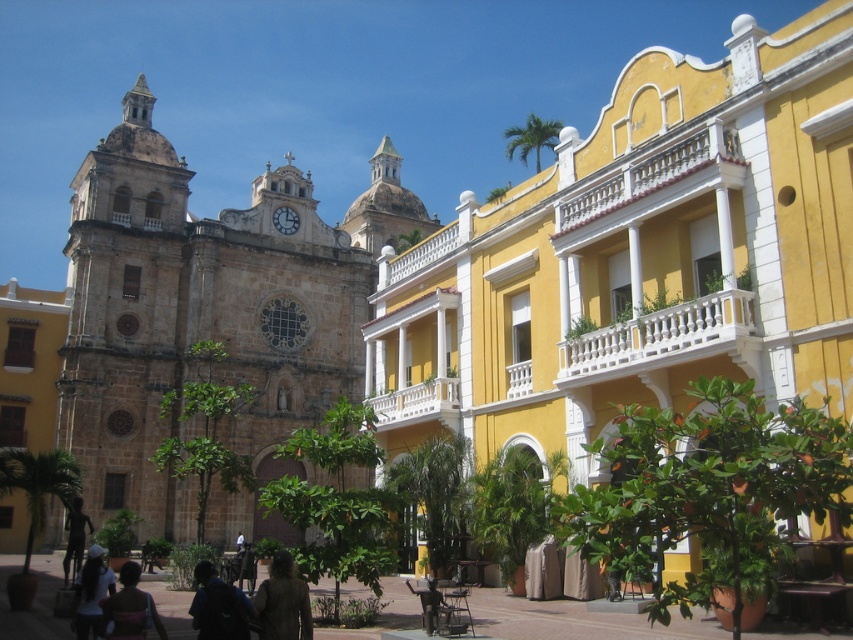
Which is behind, point (770, 212) or point (283, 573)?

The point (770, 212) is behind.

Consider the image. Is the position of matte stone church at center less distant than that of brown textured coat at lower center?

Yes, matte stone church at center is in front of brown textured coat at lower center.

Does point (573, 362) lie in front of point (299, 632)?

No, (573, 362) is behind (299, 632).

The height and width of the screenshot is (640, 853). Identify the location of matte stone church at center. (639, 257).

What do you see at coordinates (207, 317) in the screenshot? The image size is (853, 640). I see `brown stone church at left` at bounding box center [207, 317].

Locate an element on the screen. brown stone church at left is located at coordinates (207, 317).

Identify the location of brown stone church at left. (207, 317).

Can you confirm if dark blue backpack at lower center is bigger than dark brown leather jacket at lower center?

Yes, dark blue backpack at lower center is bigger than dark brown leather jacket at lower center.

Where is `dark blue backpack at lower center`? The height and width of the screenshot is (640, 853). dark blue backpack at lower center is located at coordinates (218, 605).

The width and height of the screenshot is (853, 640). I want to click on dark blue backpack at lower center, so click(x=218, y=605).